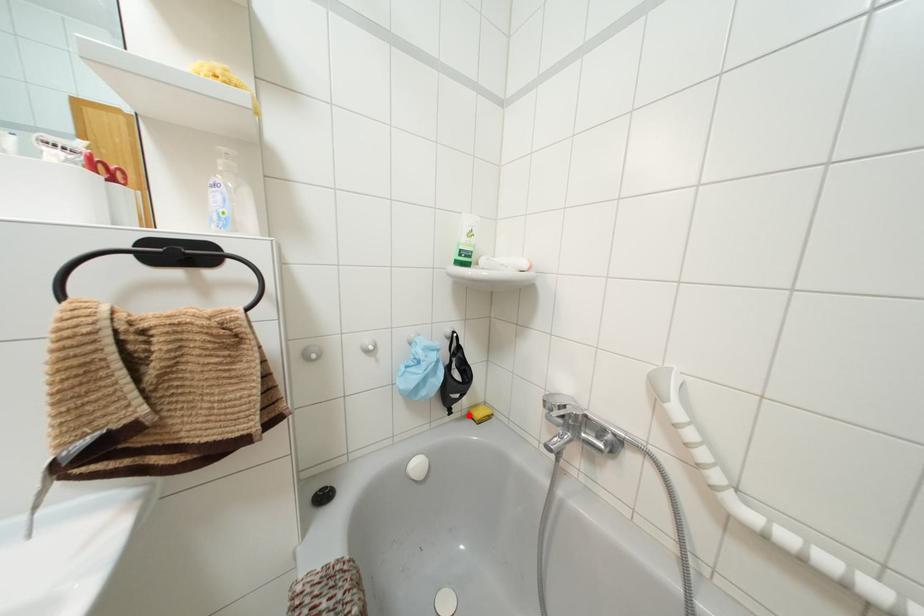
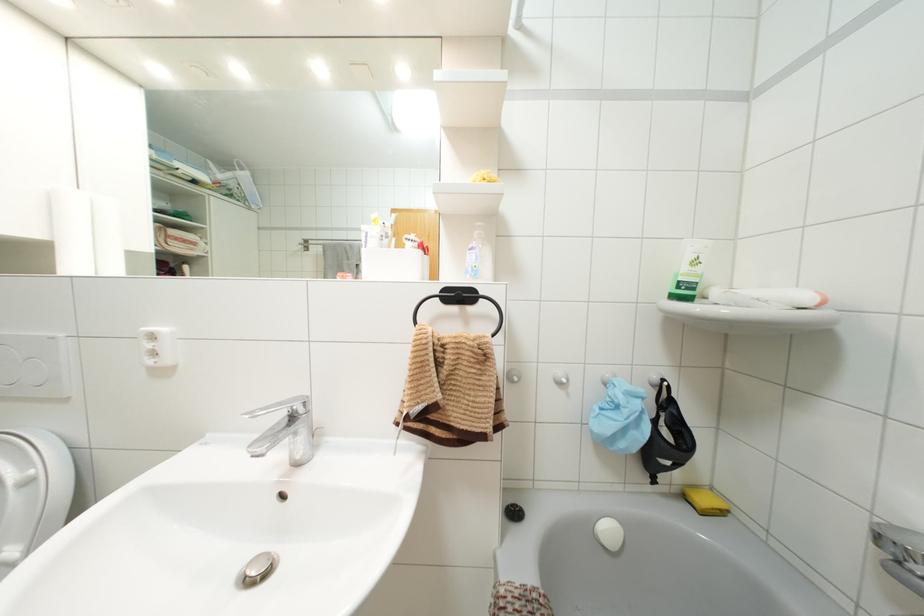
Question: I am providing you with two images of the same scene from different viewpoints. Image1 has a red point marked. In image2, the corresponding 3D location appears at what relative position? Reply with the corresponding letter.

Choices:
 (A) Closer
 (B) Farther

Answer: (A)